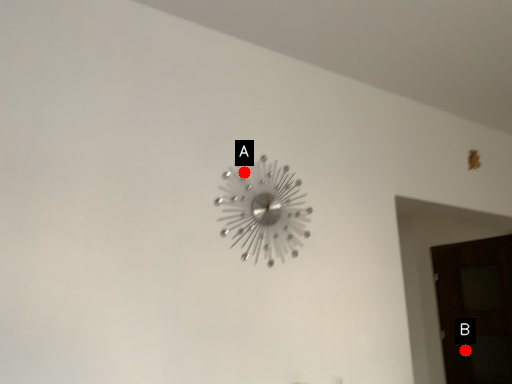
Question: Two points are circled on the image, labeled by A and B beside each circle. Among these points, which one is farthest from the camera?

Choices:
 (A) A is further
 (B) B is further

Answer: (B)